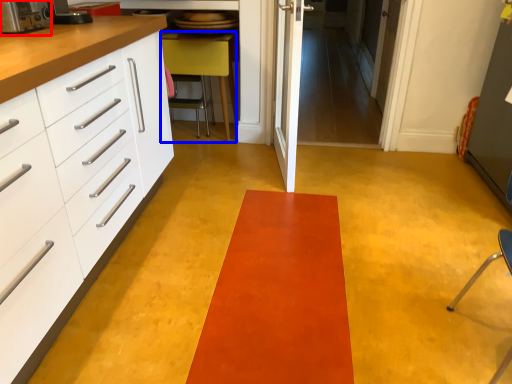
Question: Among these objects, which one is nearest to the camera, appliance (highlighted by a red box) or furniture (highlighted by a blue box)?

Choices:
 (A) appliance
 (B) furniture

Answer: (A)